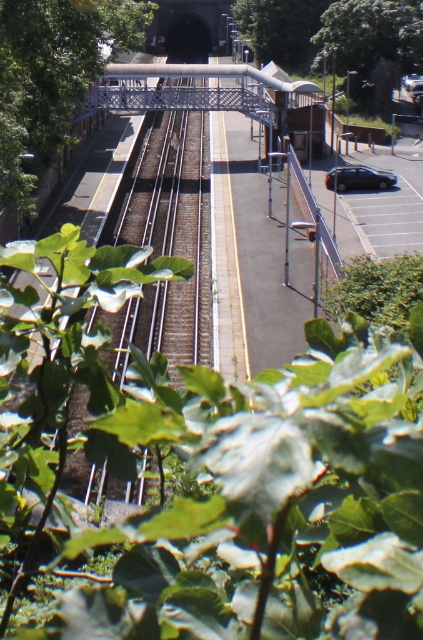
Does point (47, 140) come in front of point (386, 76)?

Yes, point (47, 140) is closer to viewer.

Is green leafy tree at left positioned before green leafy tree at upper right?

Yes, green leafy tree at left is closer to the viewer.

Is point (47, 61) behind point (348, 17)?

No, (47, 61) is closer to viewer.

Identify the location of green leafy tree at left. This screenshot has height=640, width=423. (52, 76).

Does green leafy tree at upper right have a lesser width compared to satin black car at right?

Incorrect, green leafy tree at upper right's width is not less than satin black car at right's.

Is green leafy tree at upper right above satin black car at right?

Indeed, green leafy tree at upper right is positioned over satin black car at right.

At what (x,y) coordinates should I click in order to perform the action: click on green leafy tree at upper right. Please return your answer as a coordinate pair (x, y). The image size is (423, 640). Looking at the image, I should click on click(371, 45).

Which is more to the right, green leafy tree at left or satin black car at right?

From the viewer's perspective, satin black car at right appears more on the right side.

Which is above, green leafy tree at left or satin black car at right?

green leafy tree at left is above.

Locate an element on the screen. green leafy tree at left is located at coordinates (52, 76).